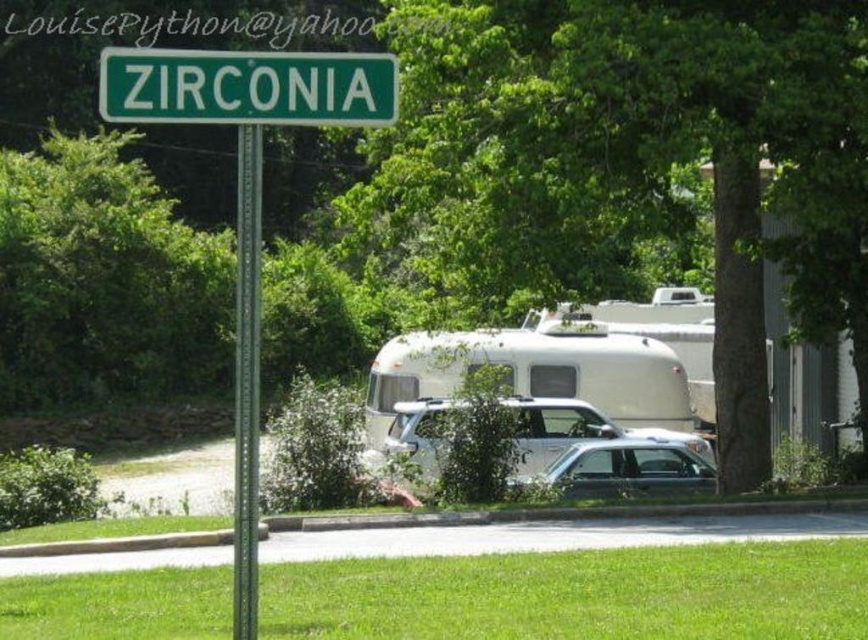
Is green leafy tree at center positioned behind satin silver suv at center?

No, it is not.

Who is positioned more to the left, green leafy tree at center or satin silver suv at center?

Positioned to the left is satin silver suv at center.

Is point (813, 29) more distant than point (540, 429)?

No, (813, 29) is in front of (540, 429).

Where is `green leafy tree at center`? green leafy tree at center is located at coordinates (633, 163).

Does green leafy tree at center appear under green metallic sign at upper center?

No.

How distant is green leafy tree at center from green metallic sign at upper center?

green leafy tree at center and green metallic sign at upper center are 17.80 meters apart.

Between point (865, 173) and point (214, 84), which one is positioned behind?

The point (865, 173) is behind.

This screenshot has height=640, width=868. I want to click on green leafy tree at center, so click(633, 163).

You are a GUI agent. You are given a task and a screenshot of the screen. Output one action in this format:
    pyautogui.click(x=<x>, y=<y>)
    Task: Click on the green metallic sign at upper center
    
    Given the screenshot: What is the action you would take?
    pyautogui.click(x=247, y=86)

Between green metallic sign at upper center and green metallic pole at center, which one is positioned lower?

green metallic pole at center is lower down.

This screenshot has height=640, width=868. I want to click on green metallic sign at upper center, so click(x=247, y=86).